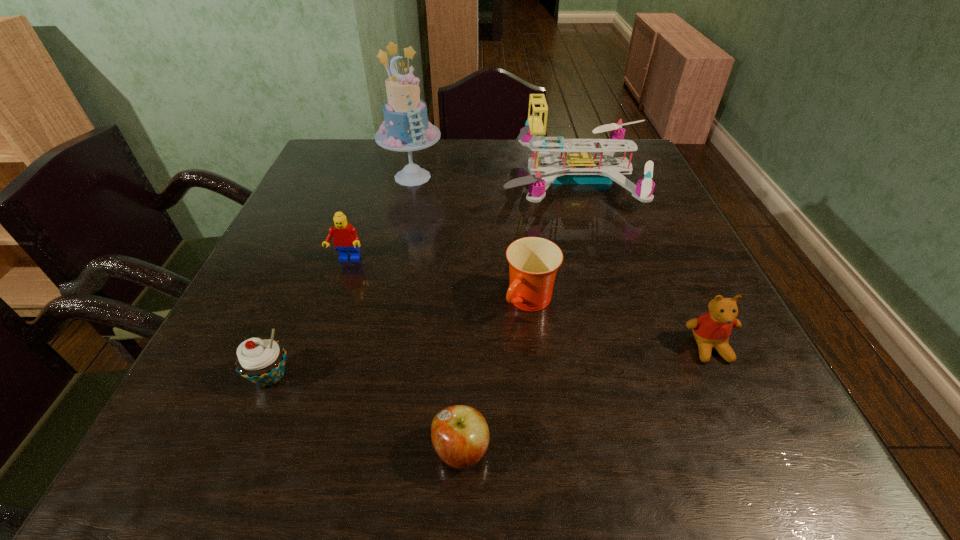
Image resolution: width=960 pixels, height=540 pixels. I want to click on vacant space positioned 0.130m on the front-facing side of the drone, so click(452, 179).

Locate an element on the screen. vacant area situated 0.090m on the front-facing side of the drone is located at coordinates (467, 179).

Identify the location of free space located 0.170m on the front-facing side of the fifth nearest object. The image size is (960, 540). (324, 327).

Where is `vacant space located 0.190m on the front-facing side of the teddy bear`? vacant space located 0.190m on the front-facing side of the teddy bear is located at coordinates (771, 477).

Where is `free space located 0.220m on the left of the cup`? The height and width of the screenshot is (540, 960). free space located 0.220m on the left of the cup is located at coordinates (392, 302).

Locate an element on the screen. The width and height of the screenshot is (960, 540). free spot located on the right of the cupcake is located at coordinates (371, 376).

You are a GUI agent. You are given a task and a screenshot of the screen. Output one action in this format:
    pyautogui.click(x=<x>, y=<y>)
    Task: Click on the vacant space located 0.210m on the right of the shortest object
    
    Given the screenshot: What is the action you would take?
    pyautogui.click(x=633, y=451)

Find the location of `cake positioned at the far edge`. cake positioned at the far edge is located at coordinates (405, 128).

At what (x,y) coordinates should I click in order to perform the action: click on drone that is at the far edge. Please return your answer as a coordinate pair (x, y). The height and width of the screenshot is (540, 960). Looking at the image, I should click on (579, 167).

The height and width of the screenshot is (540, 960). I want to click on object at the near edge, so click(x=460, y=435).